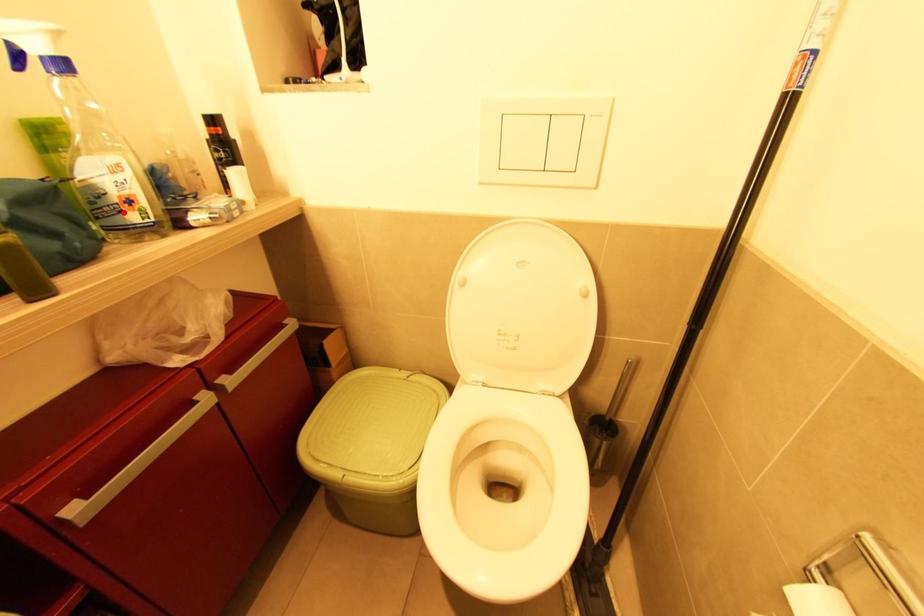
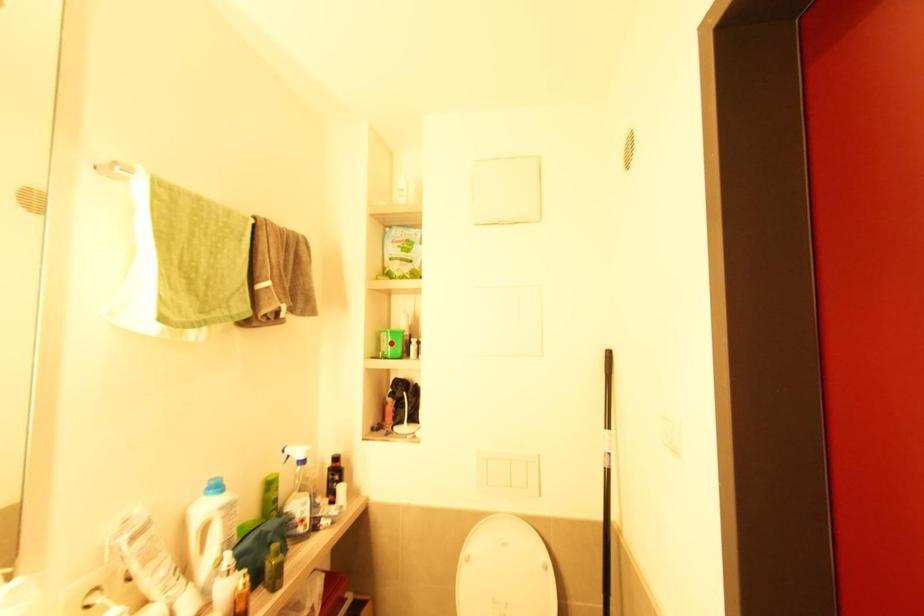
I am providing you with two images of the same scene from different viewpoints. A red point is marked on the first image and another point is marked on the second image. Is the marked point in image1 the same physical position as the marked point in image2?

No